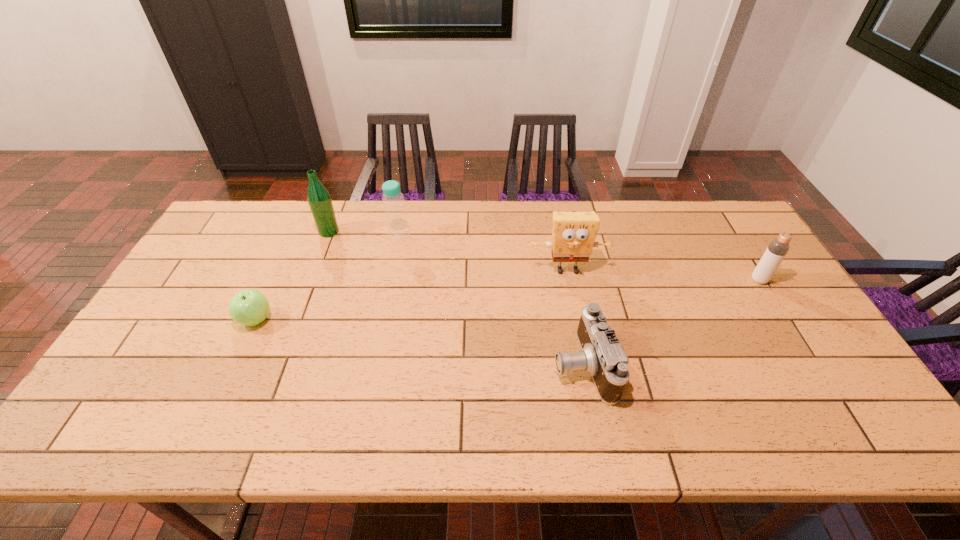
This screenshot has width=960, height=540. In order to click on unoccupied area between the leftmost bottle and the sponge in this screenshot , I will do `click(448, 251)`.

Where is `free space between the fifth tallest object and the fourth object from right to left`? The width and height of the screenshot is (960, 540). free space between the fifth tallest object and the fourth object from right to left is located at coordinates (491, 300).

Identify which object is the nearest to the second object from left to right. Please provide its 2D coordinates. Your answer should be formatted as a tuple, i.e. [(x, y)], where the tuple contains the x and y coordinates of a point satisfying the conditions above.

[(398, 231)]

Identify which object is the fifth nearest to the shortest object. Please provide its 2D coordinates. Your answer should be formatted as a tuple, i.e. [(x, y)], where the tuple contains the x and y coordinates of a point satisfying the conditions above.

[(776, 251)]

Locate which bottle is the closest to the second object from left to right. Please provide its 2D coordinates. Your answer should be formatted as a tuple, i.e. [(x, y)], where the tuple contains the x and y coordinates of a point satisfying the conditions above.

[(398, 231)]

At what (x,y) coordinates should I click in order to perform the action: click on the closest bottle to the fifth tallest object. Please return your answer as a coordinate pair (x, y). Looking at the image, I should click on (776, 251).

Where is `vacant space that satisfies the following two spatial constraints: 1. on the face of the sponge; 2. at the lens of the fifth tallest object`? vacant space that satisfies the following two spatial constraints: 1. on the face of the sponge; 2. at the lens of the fifth tallest object is located at coordinates (587, 364).

Locate an element on the screen. free location that satisfies the following two spatial constraints: 1. on the face of the rightmost object; 2. on the right side of the sponge is located at coordinates (569, 280).

Find the location of `free space that satisfies the following two spatial constraints: 1. on the face of the sponge; 2. at the lens of the camera`. free space that satisfies the following two spatial constraints: 1. on the face of the sponge; 2. at the lens of the camera is located at coordinates (587, 364).